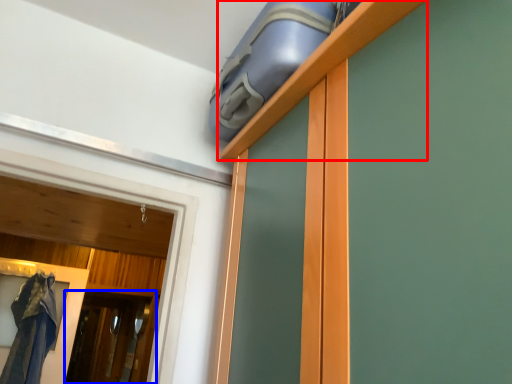
Question: Which point is closer to the camera, shelf (highlighted by a red box) or screen door (highlighted by a blue box)?

Choices:
 (A) shelf
 (B) screen door

Answer: (A)